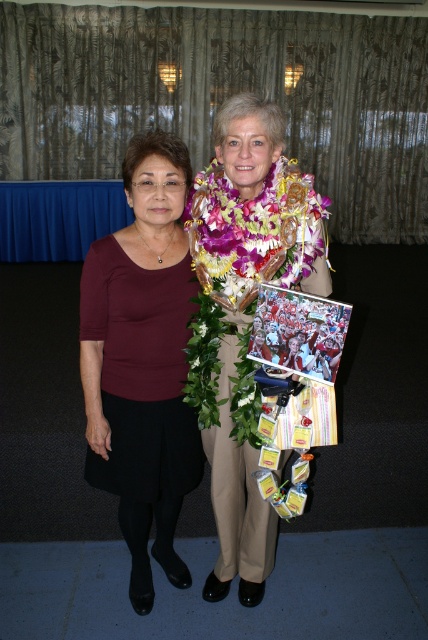
Looking at this image, is matte brown blouse at left above maroon fabric blouse at left?

Yes, matte brown blouse at left is above maroon fabric blouse at left.

At what (x,y) coordinates should I click in order to perform the action: click on matte brown blouse at left. Please return your answer as a coordinate pair (x, y). The width and height of the screenshot is (428, 640). Looking at the image, I should click on (243, 316).

Is matte brown blouse at left thinner than hawaiian lei at center?

No, matte brown blouse at left is not thinner than hawaiian lei at center.

Between point (258, 573) and point (240, 216), which one is positioned behind?

Point (258, 573)

Is point (255, 268) closer to camera compared to point (237, 355)?

Yes, point (255, 268) is in front of point (237, 355).

Locate an element on the screen. matte brown blouse at left is located at coordinates (243, 316).

Is maroon fabric blouse at left thinner than hawaiian lei at center?

Yes, maroon fabric blouse at left is thinner than hawaiian lei at center.

Can you confirm if maroon fabric blouse at left is smaller than hawaiian lei at center?

Incorrect, maroon fabric blouse at left is not smaller in size than hawaiian lei at center.

Is point (172, 308) closer to viewer compared to point (288, 198)?

No, (172, 308) is behind (288, 198).

The height and width of the screenshot is (640, 428). Find the location of `maroon fabric blouse at left`. maroon fabric blouse at left is located at coordinates (142, 360).